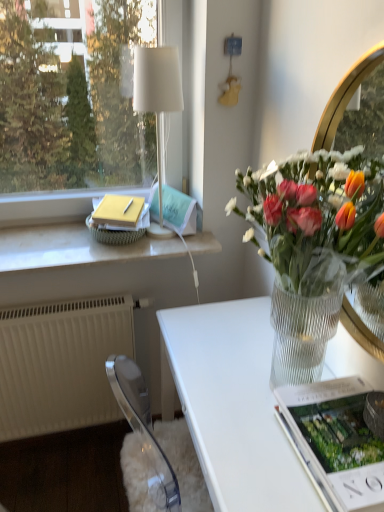
Question: Is matte green magazine at upper center, which is the 2th magazine in bottom-to-top order, oriented away from matte white magazine at lower right, which appears as the 2th magazine when viewed from the back?

Choices:
 (A) yes
 (B) no

Answer: (B)

Question: Is matte green magazine at upper center, which is the 2th magazine in front-to-back order, bigger than matte white magazine at lower right, the first magazine from the right?

Choices:
 (A) no
 (B) yes

Answer: (A)

Question: Is matte white magazine at lower right, which is the first magazine in bottom-to-top order, completely or partially inside matte green magazine at upper center, which is the 2th magazine in bottom-to-top order?

Choices:
 (A) no
 (B) yes

Answer: (A)

Question: Is matte green magazine at upper center, which is the 1th magazine from top to bottom, to the right of matte white magazine at lower right, the 2th magazine in the top-to-bottom sequence, from the viewer's perspective?

Choices:
 (A) no
 (B) yes

Answer: (A)

Question: Is the position of matte green magazine at upper center, which appears as the 2th magazine when viewed from the right, more distant than that of matte white magazine at lower right, which is the 1th magazine in front-to-back order?

Choices:
 (A) yes
 (B) no

Answer: (A)

Question: Is white fabric lampshade at upper left in front of or behind white marble window sill at upper left in the image?

Choices:
 (A) front
 (B) behind

Answer: (A)

Question: Does point (140, 112) appear closer or farther from the camera than point (29, 261)?

Choices:
 (A) farther
 (B) closer

Answer: (A)

Question: Is white fabric lampshade at upper left to the left or to the right of white marble window sill at upper left in the image?

Choices:
 (A) left
 (B) right

Answer: (B)

Question: Is white fabric lampshade at upper left inside the boundaries of white marble window sill at upper left, or outside?

Choices:
 (A) outside
 (B) inside

Answer: (A)

Question: From a real-world perspective, is white marble window sill at upper left above or below matte green magazine at upper center, which is the 2th magazine in bottom-to-top order?

Choices:
 (A) above
 (B) below

Answer: (B)

Question: Looking at the image, does white marble window sill at upper left seem bigger or smaller compared to matte green magazine at upper center, which is the 2th magazine in bottom-to-top order?

Choices:
 (A) small
 (B) big

Answer: (B)

Question: Considering their positions, is white marble window sill at upper left located in front of or behind matte green magazine at upper center, which appears as the 2th magazine when viewed from the right?

Choices:
 (A) front
 (B) behind

Answer: (A)

Question: Considering the positions of white marble window sill at upper left and matte green magazine at upper center, the first magazine positioned from the left, in the image, is white marble window sill at upper left wider or thinner than matte green magazine at upper center, the first magazine positioned from the left,?

Choices:
 (A) thin
 (B) wide

Answer: (B)

Question: Is point (362, 324) positioned closer to the camera than point (6, 352)?

Choices:
 (A) farther
 (B) closer

Answer: (B)

Question: Is clear gold mirror at upper right taller or shorter than white plastic radiator at lower left?

Choices:
 (A) tall
 (B) short

Answer: (A)